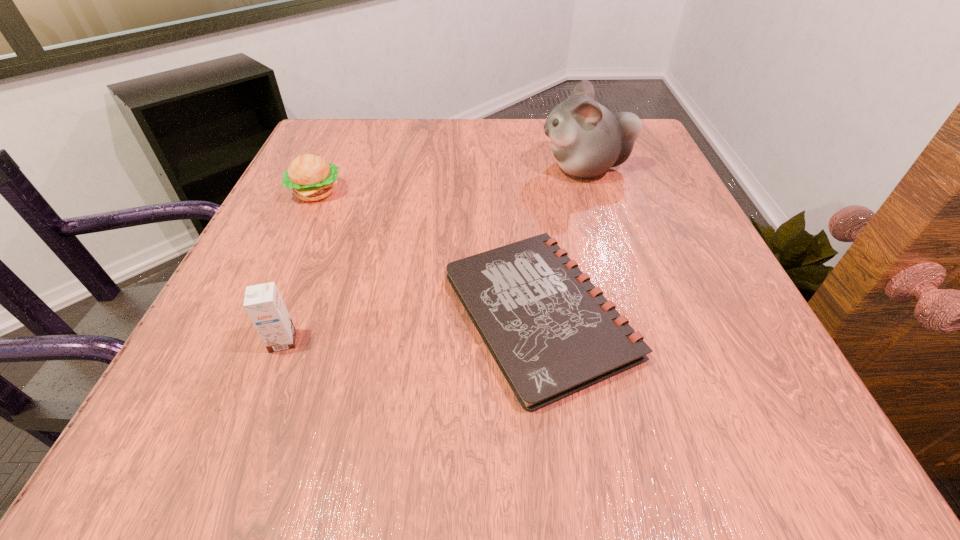
Locate an element on the screen. The width and height of the screenshot is (960, 540). free point at the far left corner is located at coordinates (337, 154).

Image resolution: width=960 pixels, height=540 pixels. Find the location of `blank area at the far right corner`. blank area at the far right corner is located at coordinates (642, 134).

Find the location of `unoccupied position between the third tallest object and the notebook`. unoccupied position between the third tallest object and the notebook is located at coordinates (427, 253).

Where is `vacant space in between the hamburger and the shortest object`? The image size is (960, 540). vacant space in between the hamburger and the shortest object is located at coordinates (427, 253).

Locate an element on the screen. The width and height of the screenshot is (960, 540). vacant area that lies between the hamster and the notebook is located at coordinates (562, 241).

Where is `free space that is in between the hamster and the third tallest object`? This screenshot has width=960, height=540. free space that is in between the hamster and the third tallest object is located at coordinates (450, 180).

Locate an element on the screen. The height and width of the screenshot is (540, 960). unoccupied area between the notebook and the hamster is located at coordinates (562, 241).

Find the location of a particular element. Image resolution: width=960 pixels, height=540 pixels. vacant region between the shortest object and the hamburger is located at coordinates (427, 253).

Where is `free space between the third shortest object and the tallest object`? free space between the third shortest object and the tallest object is located at coordinates (434, 255).

The height and width of the screenshot is (540, 960). Identify the location of vacant space in between the tallest object and the third tallest object. (450, 180).